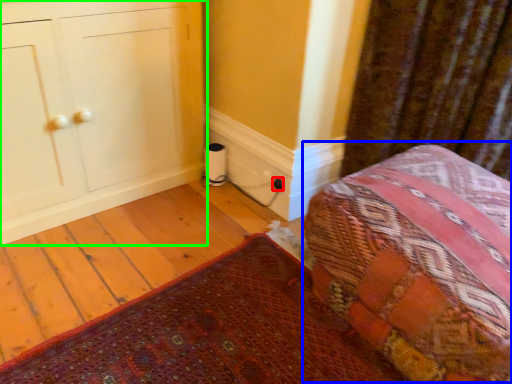
Question: Based on their relative distances, which object is nearer to electric outlet (highlighted by a red box)? Choose from bed (highlighted by a blue box) and furniture (highlighted by a green box).

Choices:
 (A) bed
 (B) furniture

Answer: (B)